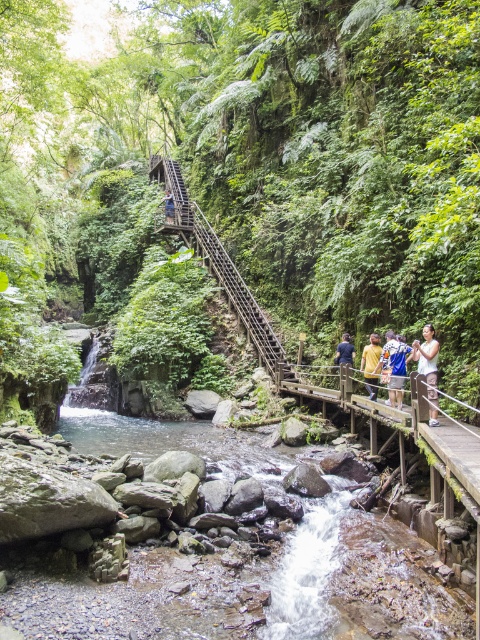
Between light brown wooden bridge at lower right and blue fabric shirt at center-right, which one has less height?

blue fabric shirt at center-right

Who is higher up, light brown wooden bridge at lower right or blue fabric shirt at center-right?

light brown wooden bridge at lower right is above.

Who is more forward, (x=428, y=369) or (x=344, y=333)?

Point (x=428, y=369) is in front.

Identify the location of light brown wooden bridge at lower right. (429, 368).

Can you confirm if green leafy forest at center is wider than blue denim shorts at center?

Yes.

Which of these two, green leafy forest at center or blue denim shorts at center, stands shorter?

Standing shorter between the two is blue denim shorts at center.

Which is in front, point (139, 272) or point (407, 360)?

Point (407, 360) is in front.

Locate an element on the screen. The height and width of the screenshot is (640, 480). green leafy forest at center is located at coordinates (250, 168).

Measure the distance between green leafy forest at center and wooden staircase at upper center.

green leafy forest at center and wooden staircase at upper center are 13.03 meters apart.

Does green leafy forest at center appear over wooden staircase at upper center?

Yes.

At what (x,y) coordinates should I click in order to perform the action: click on green leafy forest at center. Please return your answer as a coordinate pair (x, y). Looking at the image, I should click on (250, 168).